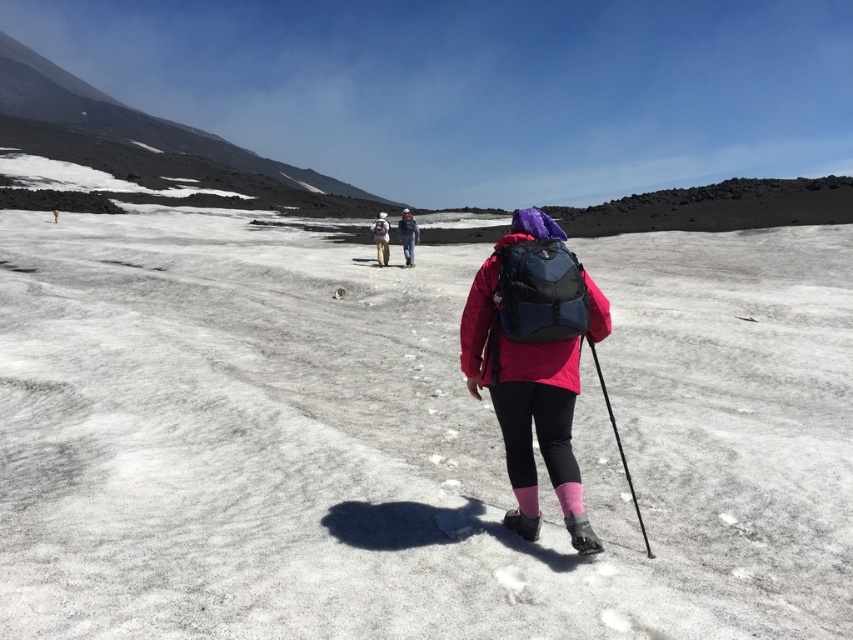
You are a hiker trying to navigate the snowy terrain. You notice the black plastic ski pole at center and the matte gray jacket at center. Which object is closer to you?

The black plastic ski pole at center is closer to you because it is in front of the matte gray jacket at center.

You are a hiker planning to place a lightweight item on the matte black backpack at center for better visibility. Since the black plastic ski pole at center is nearby, will placing the item there block the view of the ski pole?

The matte black backpack at center is located above the black plastic ski pole at center, so placing an item on the backpack would not block the view of the ski pole since it is positioned higher up.

You are planning to take a photo of the white snow at center and the matte black backpack at center. Which object will occupy more space in your photo?

The white snow at center will occupy more space in the photo because its width is larger than the matte black backpack at center.